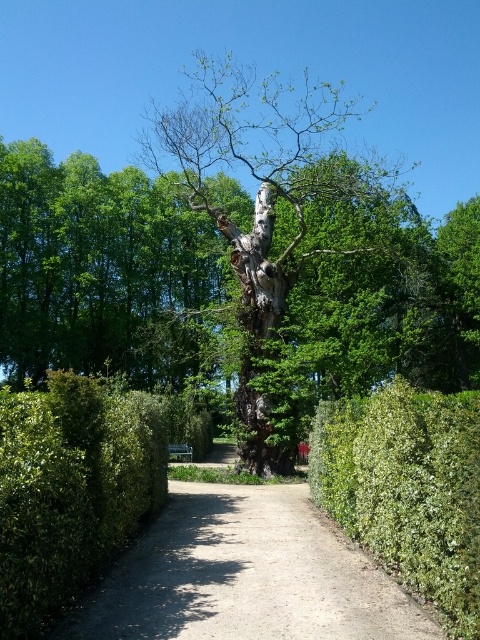
You are a gardener planning to plant a new flower bed between the dark brown bark tree at center and the green leafy hedge at center. The flower bed requires a minimum of 70 feet of space. Can you determine if there is enough space between them to accommodate the flower bed?

The dark brown bark tree at center and the green leafy hedge at center are 73.44 feet apart from each other. Since the required space for the flower bed is 70 feet, there is enough space between them to accommodate the flower bed.